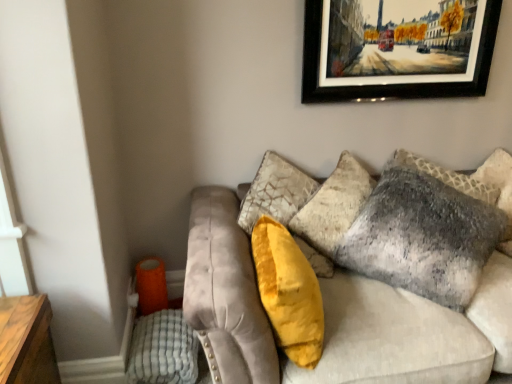
Question: Considering the relative sizes of yellow fabric pillow at center, placed as the 1th pillow when sorted from left to right, and textured gray pillow at upper right, marked as the second pillow in a right-to-left arrangement, in the image provided, is yellow fabric pillow at center, placed as the 1th pillow when sorted from left to right, smaller than textured gray pillow at upper right, marked as the second pillow in a right-to-left arrangement,?

Choices:
 (A) no
 (B) yes

Answer: (B)

Question: Could you tell me if yellow fabric pillow at center, placed as the 1th pillow when sorted from left to right, is facing textured gray pillow at upper right, marked as the second pillow in a right-to-left arrangement?

Choices:
 (A) no
 (B) yes

Answer: (B)

Question: Can you confirm if yellow fabric pillow at center, placed as the 1th pillow when sorted from left to right, is bigger than textured gray pillow at upper right, which ranks as the second pillow in left-to-right order?

Choices:
 (A) yes
 (B) no

Answer: (B)

Question: Would you say textured gray pillow at upper right, marked as the second pillow in a right-to-left arrangement, is part of yellow fabric pillow at center, placed as the 1th pillow when sorted from left to right,'s contents?

Choices:
 (A) no
 (B) yes

Answer: (A)

Question: Can you confirm if yellow fabric pillow at center, placed as the 1th pillow when sorted from left to right, is thinner than textured gray pillow at upper right, which ranks as the second pillow in left-to-right order?

Choices:
 (A) yes
 (B) no

Answer: (A)

Question: Considering the relative positions of yellow fabric pillow at center, which is the third pillow in right-to-left order, and textured gray pillow at upper right, marked as the second pillow in a right-to-left arrangement, in the image provided, is yellow fabric pillow at center, which is the third pillow in right-to-left order, to the left of textured gray pillow at upper right, marked as the second pillow in a right-to-left arrangement, from the viewer's perspective?

Choices:
 (A) yes
 (B) no

Answer: (A)

Question: Is yellow fabric pillow at center, placed as the 1th pillow when sorted from left to right, aimed at velvet gray couch at center?

Choices:
 (A) no
 (B) yes

Answer: (B)

Question: Does yellow fabric pillow at center, placed as the 1th pillow when sorted from left to right, have a larger size compared to velvet gray couch at center?

Choices:
 (A) yes
 (B) no

Answer: (B)

Question: Is yellow fabric pillow at center, placed as the 1th pillow when sorted from left to right, positioned with its back to velvet gray couch at center?

Choices:
 (A) yes
 (B) no

Answer: (A)

Question: Can you see yellow fabric pillow at center, placed as the 1th pillow when sorted from left to right, touching velvet gray couch at center?

Choices:
 (A) no
 (B) yes

Answer: (A)

Question: From a real-world perspective, does yellow fabric pillow at center, which is the third pillow in right-to-left order, stand above velvet gray couch at center?

Choices:
 (A) no
 (B) yes

Answer: (B)

Question: Considering the relative sizes of yellow fabric pillow at center, placed as the 1th pillow when sorted from left to right, and velvet gray couch at center in the image provided, is yellow fabric pillow at center, placed as the 1th pillow when sorted from left to right, shorter than velvet gray couch at center?

Choices:
 (A) yes
 (B) no

Answer: (A)

Question: Can you confirm if velvet gray couch at center is wider than textured gray pillow at upper right, which ranks as the second pillow in left-to-right order?

Choices:
 (A) yes
 (B) no

Answer: (A)